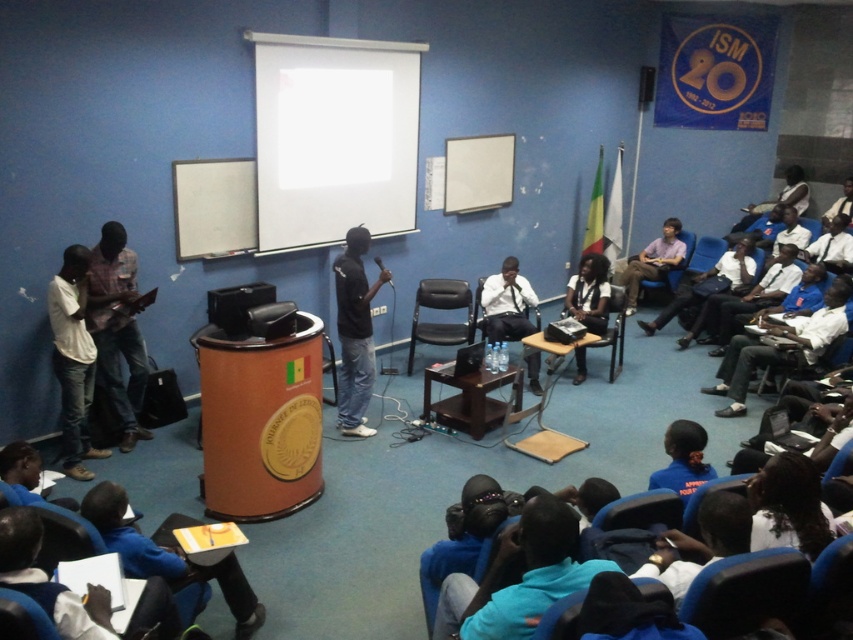
Looking at this image, does blue fabric chair at lower right have a larger size compared to matte black shirt at center?

Incorrect, blue fabric chair at lower right is not larger than matte black shirt at center.

Is blue fabric chair at lower right positioned at the back of matte black shirt at center?

No, it is in front of matte black shirt at center.

What do you see at coordinates (746, 593) in the screenshot? Image resolution: width=853 pixels, height=640 pixels. I see `blue fabric chair at lower right` at bounding box center [746, 593].

You are a GUI agent. You are given a task and a screenshot of the screen. Output one action in this format:
    pyautogui.click(x=<x>, y=<y>)
    Task: Click on the blue fabric chair at lower right
    The width and height of the screenshot is (853, 640).
    Given the screenshot: What is the action you would take?
    pyautogui.click(x=746, y=593)

In the scene shown: Does black plastic chair at center have a greater width compared to dark blue fabric chair at lower left?

Correct, the width of black plastic chair at center exceeds that of dark blue fabric chair at lower left.

Looking at this image, can you confirm if black plastic chair at center is smaller than dark blue fabric chair at lower left?

Incorrect, black plastic chair at center is not smaller in size than dark blue fabric chair at lower left.

Is point (473, 320) more distant than point (44, 620)?

That is True.

Image resolution: width=853 pixels, height=640 pixels. Identify the location of black plastic chair at center. (442, 308).

Can you confirm if plaid fabric shirt at left is bigger than matte black shirt at center?

Yes, plaid fabric shirt at left is bigger than matte black shirt at center.

Is point (96, 273) positioned after point (521, 333)?

That is False.

This screenshot has height=640, width=853. What do you see at coordinates (117, 330) in the screenshot?
I see `plaid fabric shirt at left` at bounding box center [117, 330].

I want to click on plaid fabric shirt at left, so click(117, 330).